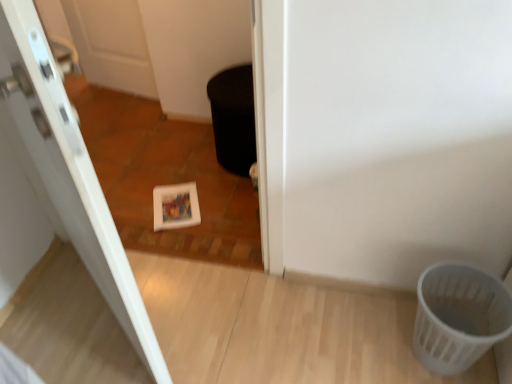
Question: Would you say white glossy door at upper left is outside black matte potty at center?

Choices:
 (A) no
 (B) yes

Answer: (B)

Question: From the image's perspective, does white glossy door at upper left appear higher than black matte potty at center?

Choices:
 (A) yes
 (B) no

Answer: (B)

Question: Is white glossy door at upper left bigger than black matte potty at center?

Choices:
 (A) yes
 (B) no

Answer: (A)

Question: Does white glossy door at upper left come behind black matte potty at center?

Choices:
 (A) yes
 (B) no

Answer: (B)

Question: Is black matte potty at center at the back of white glossy door at upper left?

Choices:
 (A) no
 (B) yes

Answer: (A)

Question: Considering the relative sizes of white glossy door at upper left and black matte potty at center in the image provided, is white glossy door at upper left wider than black matte potty at center?

Choices:
 (A) yes
 (B) no

Answer: (B)

Question: Is white plastic basket at lower right smaller than white glossy door at upper left?

Choices:
 (A) yes
 (B) no

Answer: (A)

Question: Is white plastic basket at lower right closer to camera compared to white glossy door at upper left?

Choices:
 (A) no
 (B) yes

Answer: (A)

Question: Are white plastic basket at lower right and white glossy door at upper left making contact?

Choices:
 (A) yes
 (B) no

Answer: (B)

Question: Could white glossy door at upper left be considered to be inside white plastic basket at lower right?

Choices:
 (A) no
 (B) yes

Answer: (A)

Question: From a real-world perspective, is white plastic basket at lower right on top of white glossy door at upper left?

Choices:
 (A) no
 (B) yes

Answer: (A)

Question: Is white plastic basket at lower right to the right of white glossy door at upper left from the viewer's perspective?

Choices:
 (A) no
 (B) yes

Answer: (B)

Question: From a real-world perspective, is black matte potty at center physically below white plastic basket at lower right?

Choices:
 (A) yes
 (B) no

Answer: (B)